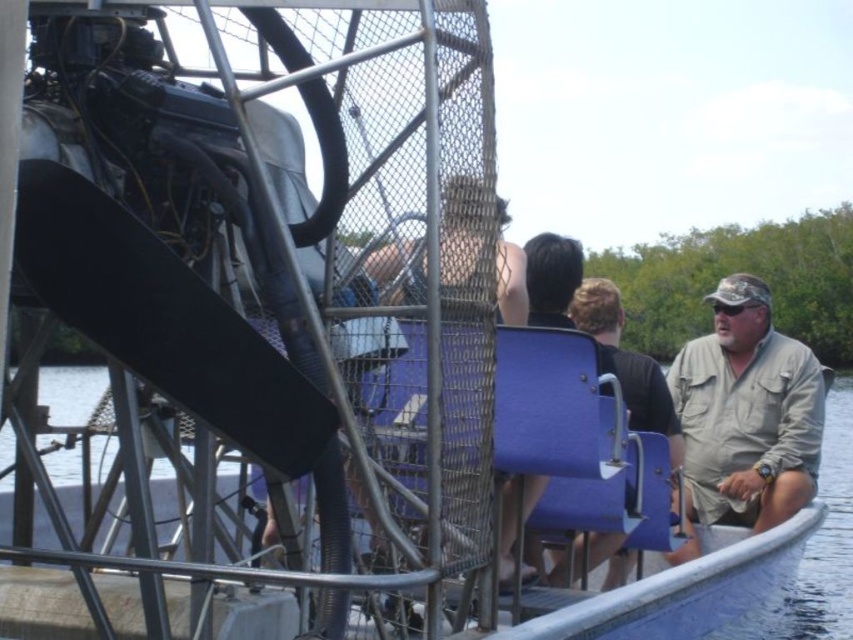
Question: Estimate the real-world distances between objects in this image. Which object is closer to the khaki fabric shirt at right?

Choices:
 (A) light brown leather jacket at center
 (B) blue plastic seat at center

Answer: (A)

Question: Estimate the real-world distances between objects in this image. Which object is closer to the khaki fabric shirt at right?

Choices:
 (A) blue plastic seat at center
 (B) light brown leather jacket at center

Answer: (B)

Question: Which object is the farthest from the light brown leather jacket at center?

Choices:
 (A) blue plastic seat at center
 (B) khaki fabric shirt at right

Answer: (A)

Question: Does khaki fabric shirt at right appear on the left side of light brown leather jacket at center?

Choices:
 (A) no
 (B) yes

Answer: (A)

Question: Does khaki fabric shirt at right have a greater width compared to blue plastic seat at center?

Choices:
 (A) no
 (B) yes

Answer: (A)

Question: Can you confirm if khaki fabric shirt at right is positioned to the left of blue plastic seat at center?

Choices:
 (A) yes
 (B) no

Answer: (B)